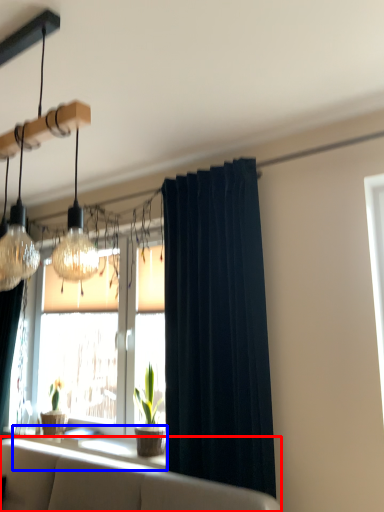
Question: Which of the following is the farthest to the observer, studio couch (highlighted by a red box) or window sill (highlighted by a blue box)?

Choices:
 (A) studio couch
 (B) window sill

Answer: (B)